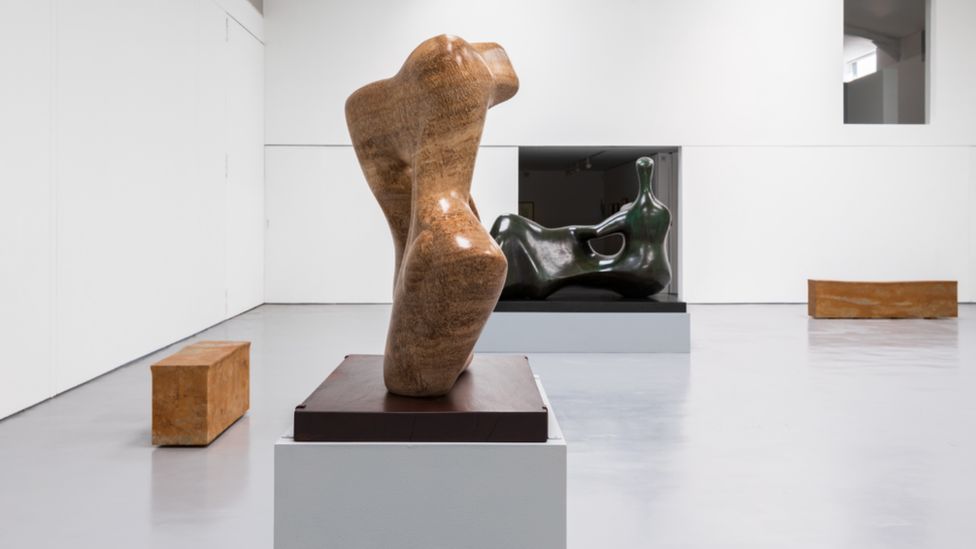
At what (x,y) coordinates should I click in order to perform the action: click on green sculpture in the background. Please return your answer as a coordinate pair (x, y). The image size is (976, 549). Looking at the image, I should click on (565, 236).